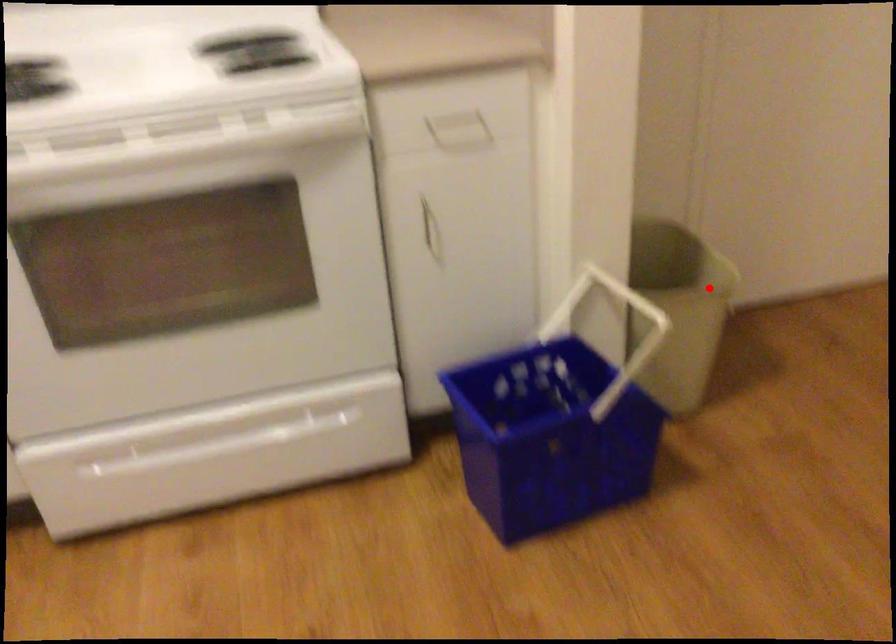
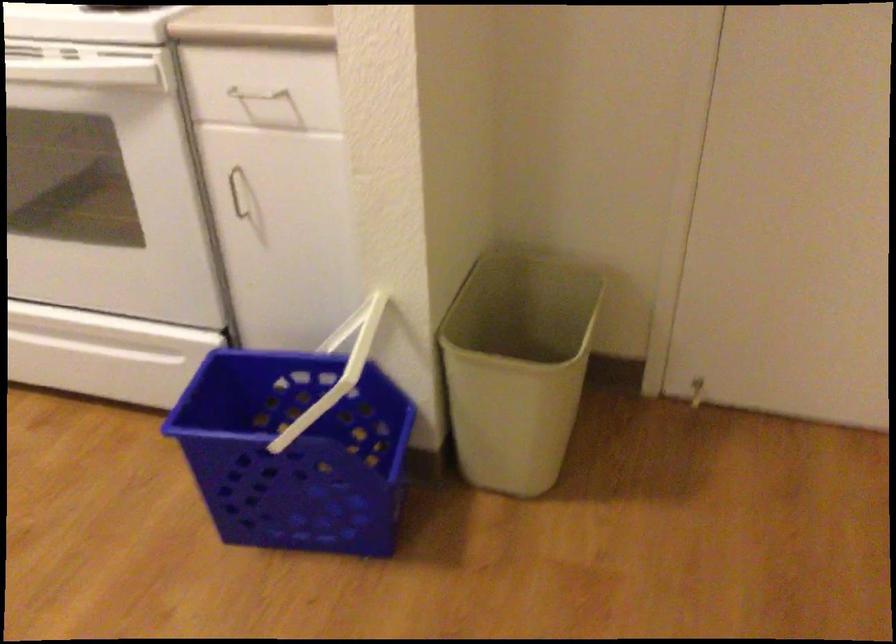
Find the pixel in the second image that matches the highlighted location in the first image.

(517, 366)